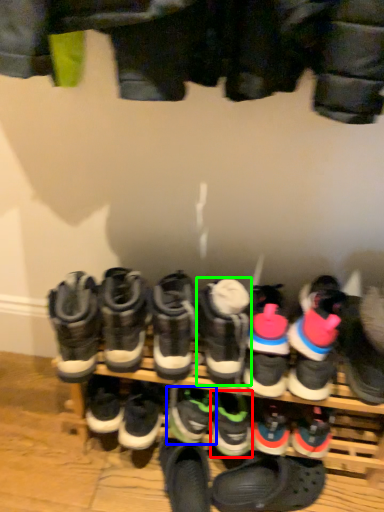
Question: Estimate the real-world distances between objects in this image. Which object is farther from footwear (highlighted by a red box), footwear (highlighted by a blue box) or footwear (highlighted by a green box)?

Choices:
 (A) footwear
 (B) footwear

Answer: (B)